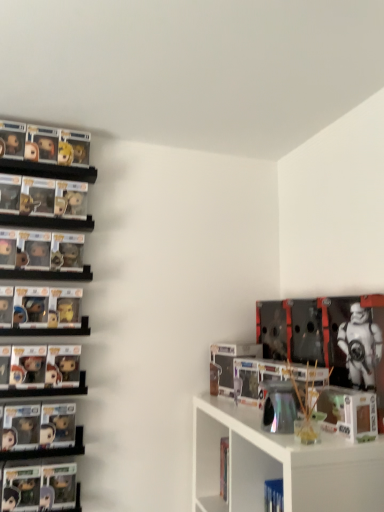
I want to click on metallic silver vase at upper right, so click(280, 464).

Describe the element at coordinates (280, 464) in the screenshot. I see `metallic silver vase at upper right` at that location.

The height and width of the screenshot is (512, 384). Identify the location of metallic silver vase at upper right. (280, 464).